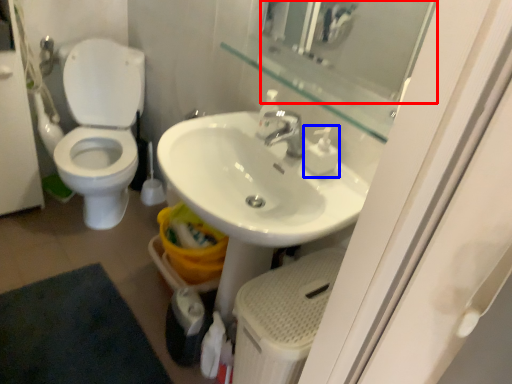
Question: Which point is closer to the camera, mirror (highlighted by a red box) or soap dispenser (highlighted by a blue box)?

Choices:
 (A) mirror
 (B) soap dispenser

Answer: (A)